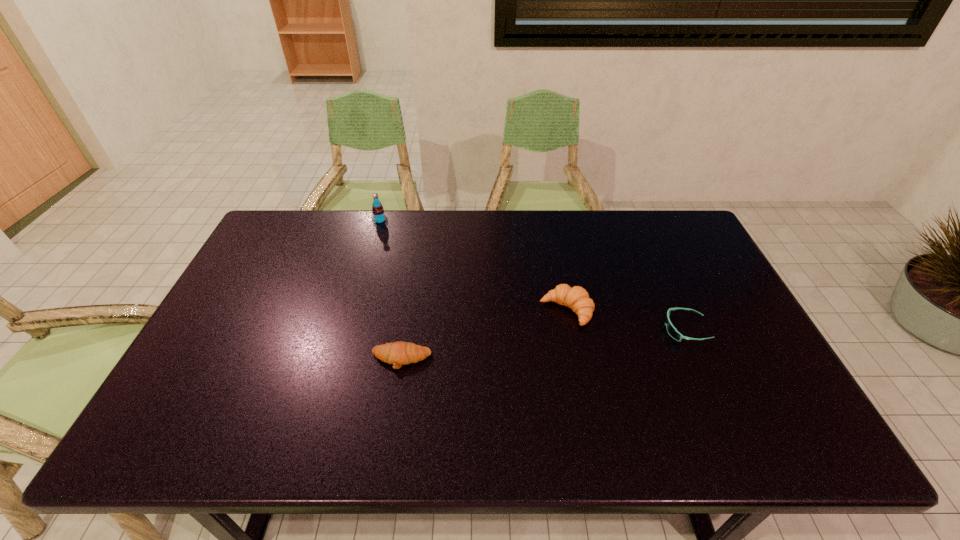
The image size is (960, 540). What are the coordinates of `vacant space located 0.390m on the front-facing side of the rightmost object` in the screenshot? It's located at (520, 329).

Identify the location of vacant space located on the front-facing side of the rightmost object. (576, 329).

Image resolution: width=960 pixels, height=540 pixels. Identify the location of free region located on the front-facing side of the rightmost object. (517, 329).

Find the location of a particular element. This screenshot has height=540, width=960. object that is at the far edge is located at coordinates (378, 217).

This screenshot has height=540, width=960. I want to click on object situated at the right edge, so click(672, 331).

Identify the location of vacant space at the far edge. [x=535, y=236].

In the image, there is a desktop. Where is `free space at the near edge`? The width and height of the screenshot is (960, 540). free space at the near edge is located at coordinates (726, 433).

Identify the location of vacant space at the left edge of the desktop. (246, 316).

At what (x,y) coordinates should I click in order to perform the action: click on free region at the right edge of the desktop. Please return your answer as a coordinate pair (x, y). Looking at the image, I should click on (711, 312).

In the image, there is a desktop. Where is `vacant space at the far left corner`? The image size is (960, 540). vacant space at the far left corner is located at coordinates (270, 234).